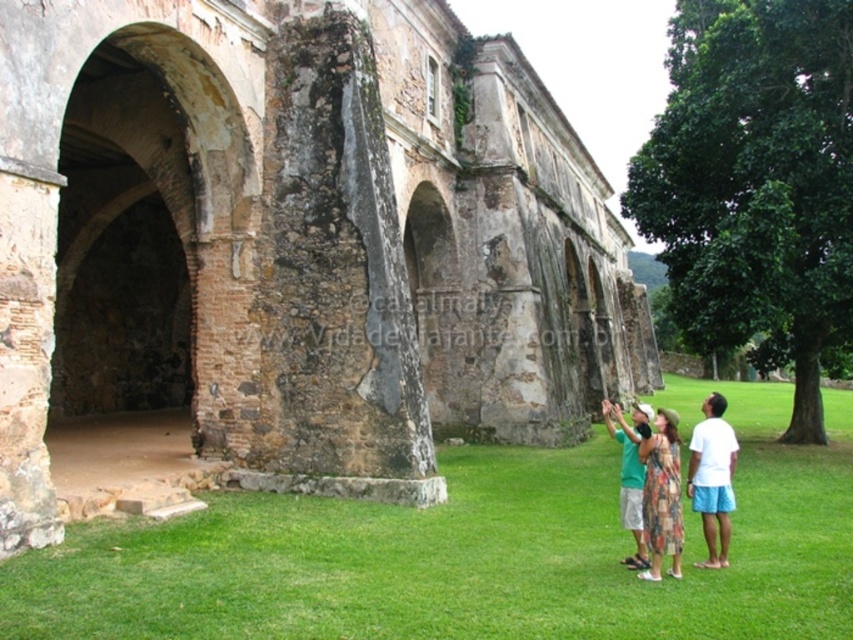
Question: Which point is closer to the camera taking this photo?

Choices:
 (A) (659, 568)
 (B) (467, 499)

Answer: (A)

Question: Which point is farther from the camera taking this photo?

Choices:
 (A) (631, 515)
 (B) (488, 211)

Answer: (B)

Question: In this image, where is weathered stone arches at center located relative to green cotton shirt at center?

Choices:
 (A) above
 (B) below

Answer: (A)

Question: Does white cotton shirt at lower right have a lesser width compared to green cotton shirt at center?

Choices:
 (A) yes
 (B) no

Answer: (A)

Question: Which of the following is the closest to the observer?

Choices:
 (A) white cotton shirt at lower right
 (B) weathered stone arches at center
 (C) green cotton shirt at center
 (D) green grass at lower center

Answer: (D)

Question: In this image, where is green grass at lower center located relative to white cotton shirt at lower right?

Choices:
 (A) right
 (B) left

Answer: (B)